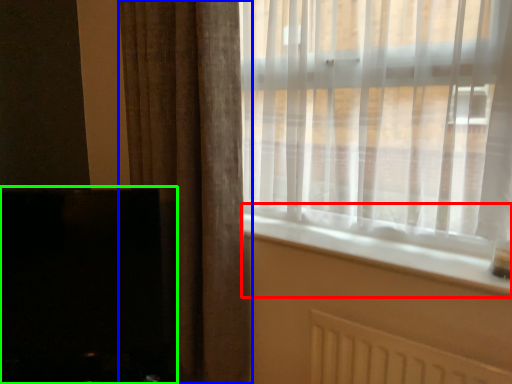
Question: Estimate the real-world distances between objects in this image. Which object is closer to window sill (highlighted by a red box), curtain (highlighted by a blue box) or fireplace (highlighted by a green box)?

Choices:
 (A) curtain
 (B) fireplace

Answer: (A)